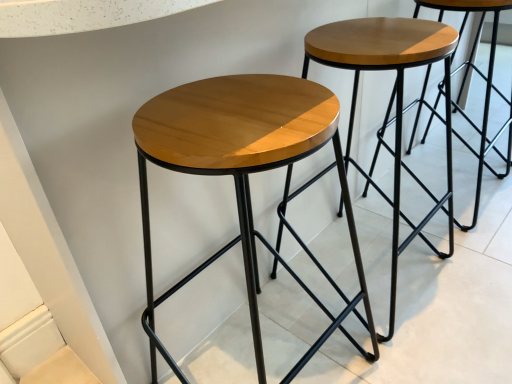
Identify the location of vacant region above wooden stool at center, the 2th stool in the left-to-right sequence (from a real-world perspective). (382, 33).